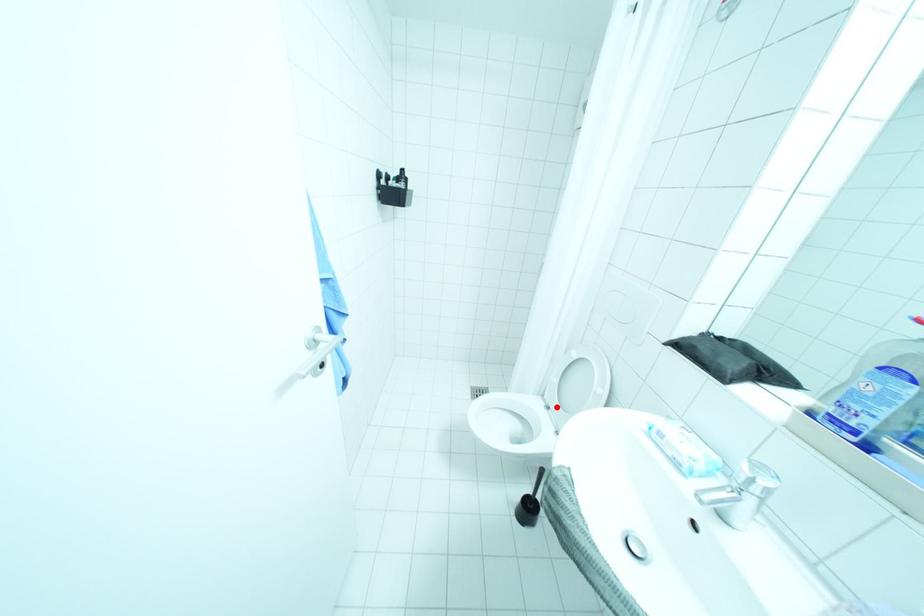
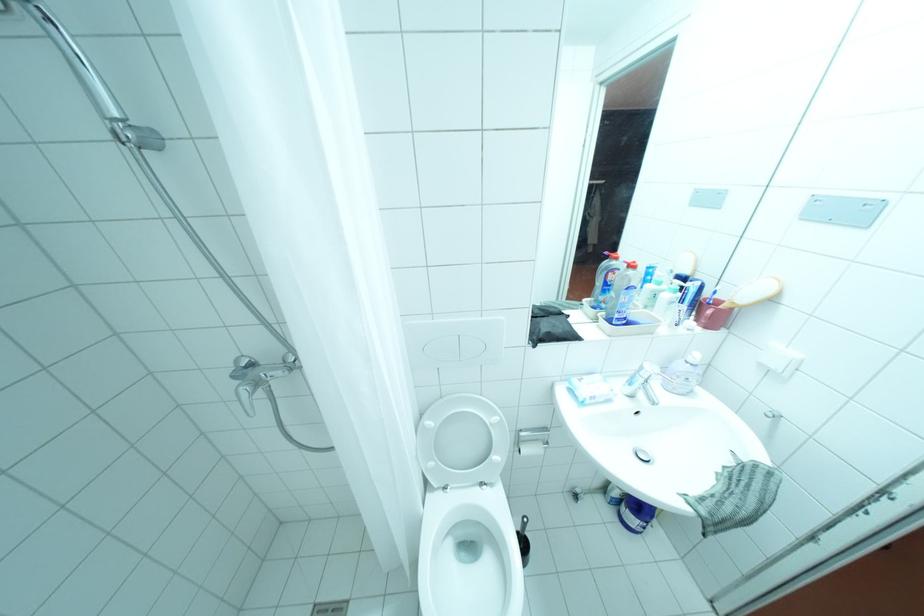
The point at the highlighted location is marked in the first image. Where is the corresponding point in the second image?

(455, 487)